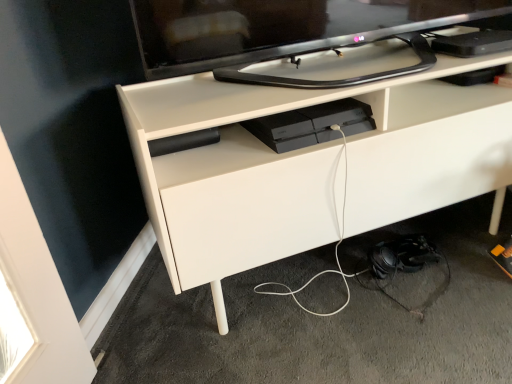
Question: From a real-world perspective, is white matte cable at lower center physically located above or below black glossy tv at upper center?

Choices:
 (A) below
 (B) above

Answer: (A)

Question: Choose the correct answer: Is white matte cable at lower center inside black glossy tv at upper center or outside it?

Choices:
 (A) inside
 (B) outside

Answer: (B)

Question: Estimate the real-world distances between objects in this image. Which object is closer to the white matte cable at lower center?

Choices:
 (A) satin black console at center
 (B) black glossy tv at upper center
 (C) white matte desk at center

Answer: (C)

Question: Considering the real-world distances, which object is farthest from the white matte desk at center?

Choices:
 (A) white matte cable at lower center
 (B) satin black console at center
 (C) black glossy tv at upper center

Answer: (A)